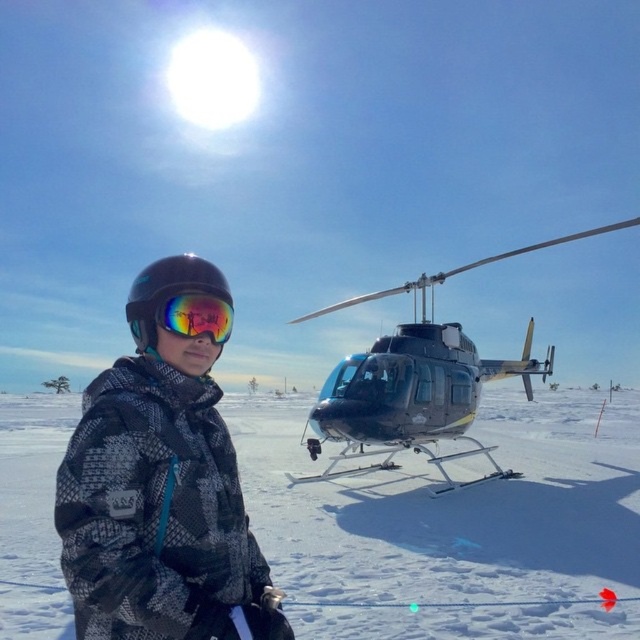
You are navigating a snowy landscape and need to locate the camouflage jacket at center. According to the coordinates provided, where exactly is the camouflage jacket positioned?

The camouflage jacket at center is located at point 0.758 on the x axis and 0.245 on the y axis.

You are a photographer trying to capture a photo of the metallic silver helicopter at center and the reflective mirrored goggles at center. Since both are at the center, how can you position yourself to ensure both are in the frame without overlapping?

The metallic silver helicopter at center is to the right of the reflective mirrored goggles at center, so positioning yourself to the left of the goggles will allow both to be captured in the frame without overlapping.

You are a photographer trying to capture a clear shot of both the camouflage jacket at center and the rimless reflective helmet at center. Since the camera can only focus on one object at a time, which object should you focus on to ensure it appears larger in the photo?

The camouflage jacket at center has a larger size compared to the rimless reflective helmet at center, so focusing on the camouflage jacket at center will ensure it appears larger in the photo.